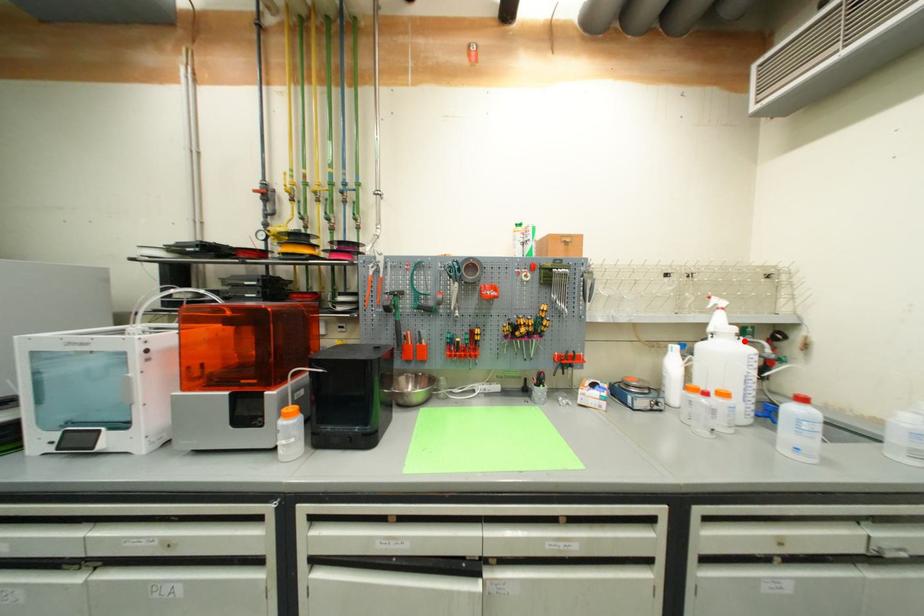
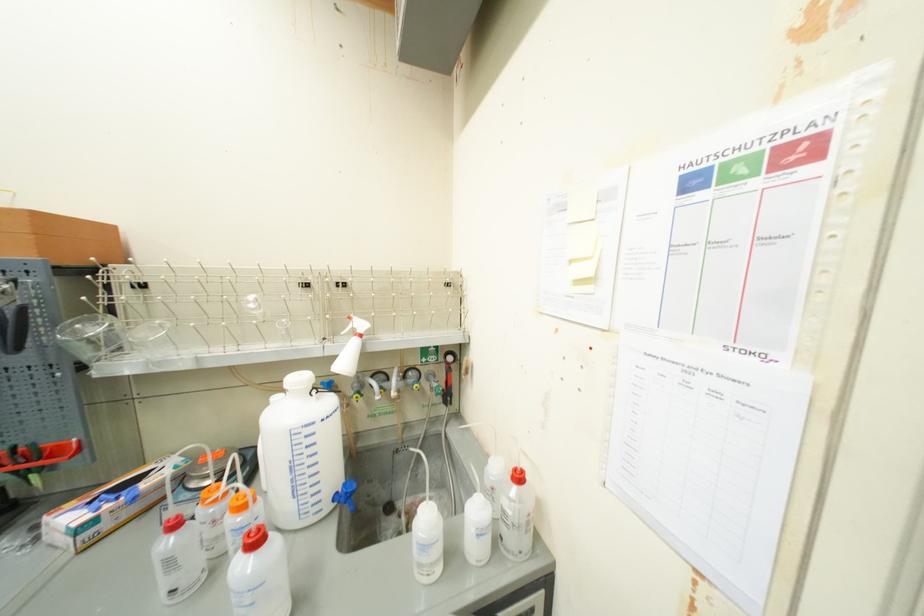
Locate, in the second image, the point that corresponds to the highlighted location in the first image.

(317, 398)